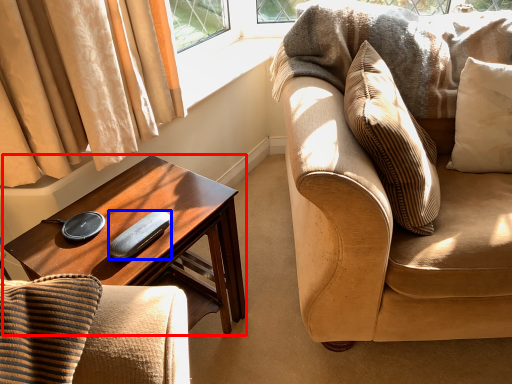
Question: Which point is closer to the camera, desk (highlighted by a red box) or remote control (highlighted by a blue box)?

Choices:
 (A) desk
 (B) remote control

Answer: (A)